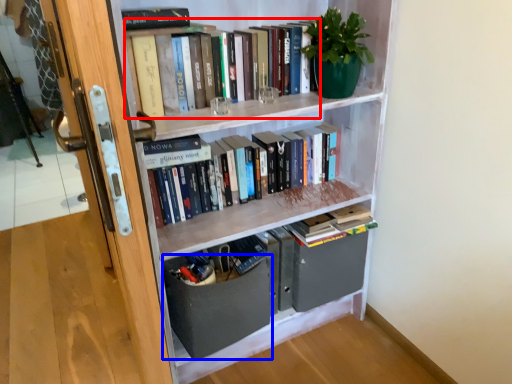
Question: Which object is further to the camera taking this photo, book (highlighted by a red box) or drawer (highlighted by a blue box)?

Choices:
 (A) book
 (B) drawer

Answer: (B)